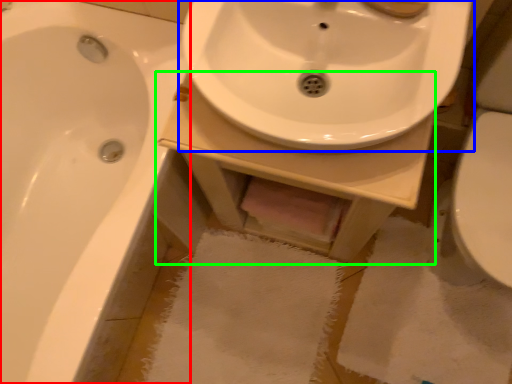
Question: Which is farther away from bathtub (highlighted by a red box)? sink (highlighted by a blue box) or counter top (highlighted by a green box)?

Choices:
 (A) sink
 (B) counter top

Answer: (A)